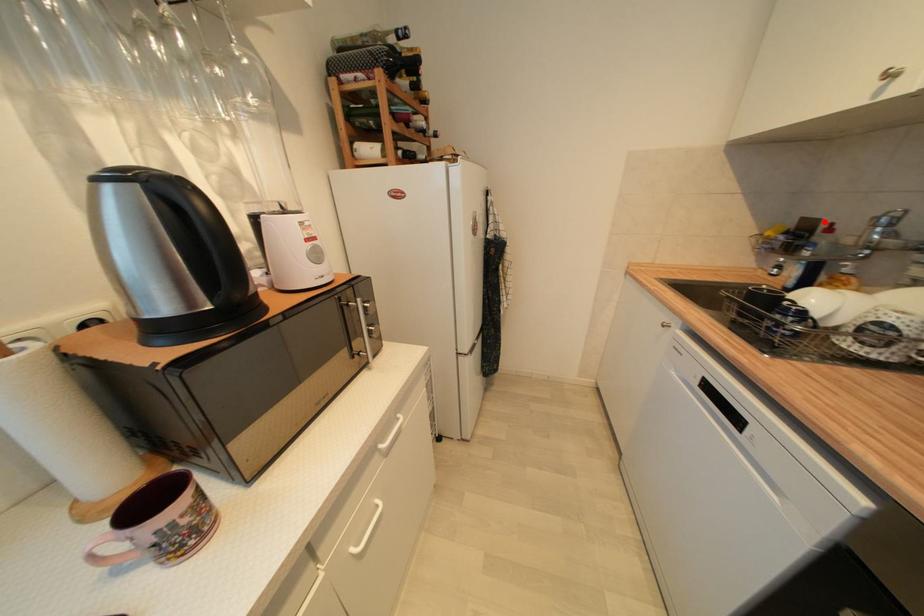
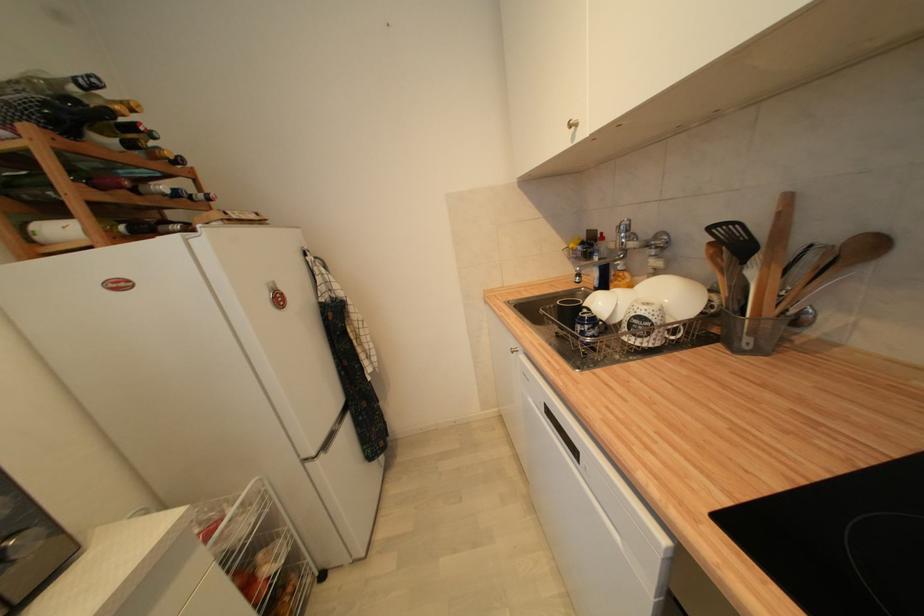
In the second image, find the point that corresponds to the highlighted location in the first image.

(602, 233)